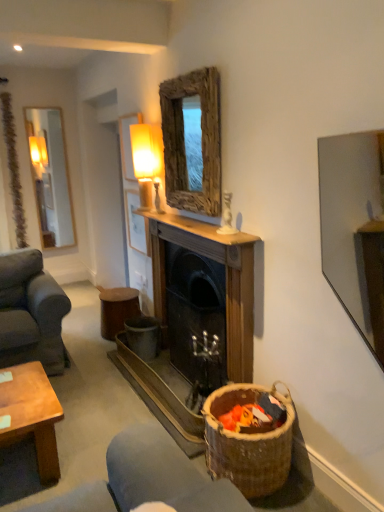
Image resolution: width=384 pixels, height=512 pixels. In order to click on rustic wood mirror at upper center in this screenshot , I will do `click(192, 141)`.

Where is `wooden stool at center`? The height and width of the screenshot is (512, 384). wooden stool at center is located at coordinates (117, 309).

The height and width of the screenshot is (512, 384). Describe the element at coordinates (226, 280) in the screenshot. I see `wooden fireplace at center` at that location.

In order to click on rustic wood mirror at upper center in this screenshot , I will do `click(192, 141)`.

Considering the positions of objects matte glass lamp at upper center and wooden fireplace at center in the image provided, who is behind, matte glass lamp at upper center or wooden fireplace at center?

matte glass lamp at upper center is behind.

Image resolution: width=384 pixels, height=512 pixels. I want to click on lamp to the left of wooden fireplace at center, so click(147, 161).

Based on their sizes in the image, would you say matte glass lamp at upper center is bigger or smaller than wooden fireplace at center?

In the image, matte glass lamp at upper center appears to be smaller than wooden fireplace at center.

Which is farther, (146, 157) or (157, 261)?

The point (157, 261) is farther from the camera.

Considering the sizes of objects wooden stool at center and rustic wood mirror at upper center in the image provided, who is smaller, wooden stool at center or rustic wood mirror at upper center?

With smaller size is rustic wood mirror at upper center.

From the picture: From the image's perspective, between wooden stool at center and rustic wood mirror at upper center, who is located below?

wooden stool at center appears lower in the image.

Does wooden stool at center appear on the left side of rustic wood mirror at upper center?

Indeed, wooden stool at center is positioned on the left side of rustic wood mirror at upper center.

How many degrees apart are the facing directions of wooden stool at center and rustic wood mirror at upper center?

0.503 degrees separate the facing orientations of wooden stool at center and rustic wood mirror at upper center.

Measure the distance between brown woven basket at lower right and matte glass lamp at upper center.

brown woven basket at lower right and matte glass lamp at upper center are 1.67 meters apart.

Which object is positioned more to the left, brown woven basket at lower right or matte glass lamp at upper center?

Positioned to the left is matte glass lamp at upper center.

Find the location of a particular element. Image resolution: width=384 pixels, height=512 pixels. basket below the matte glass lamp at upper center (from a real-world perspective) is located at coordinates (247, 443).

Considering the sizes of brown woven basket at lower right and matte glass lamp at upper center in the image, is brown woven basket at lower right wider or thinner than matte glass lamp at upper center?

In the image, brown woven basket at lower right appears to be wider than matte glass lamp at upper center.

From the image's perspective, which is above, rustic wood mirror at upper center or brown woven basket at lower right?

From the image's view, rustic wood mirror at upper center is above.

Is brown woven basket at lower right surrounded by rustic wood mirror at upper center?

Definitely not — brown woven basket at lower right is not inside rustic wood mirror at upper center.

In the scene shown: Does rustic wood mirror at upper center have a smaller size compared to brown woven basket at lower right?

Correct, rustic wood mirror at upper center occupies less space than brown woven basket at lower right.

From a real-world perspective, is rustic wood mirror at upper center on brown woven basket at lower right?

Yes.

Measure the distance between wooden fireplace at center and matte glass lamp at upper center.

They are 20.43 inches apart.

In the scene shown: Is wooden fireplace at center looking in the opposite direction of matte glass lamp at upper center?

No, wooden fireplace at center is not facing the opposite direction of matte glass lamp at upper center.

From the image's perspective, is wooden fireplace at center under matte glass lamp at upper center?

Yes, from the image's perspective, wooden fireplace at center is beneath matte glass lamp at upper center.

How many degrees apart are the facing directions of wooden fireplace at center and matte glass lamp at upper center?

The angle between the facing direction of wooden fireplace at center and the facing direction of matte glass lamp at upper center is 0.0137 degrees.

Considering the sizes of wooden stool at center and brown woven basket at lower right in the image, is wooden stool at center bigger or smaller than brown woven basket at lower right?

wooden stool at center is smaller than brown woven basket at lower right.

From a real-world perspective, who is located higher, wooden stool at center or brown woven basket at lower right?

brown woven basket at lower right, from a real-world perspective.

Is brown woven basket at lower right inside wooden stool at center?

No.

How distant is brown woven basket at lower right from rustic wood mirror at upper center?

A distance of 4.37 feet exists between brown woven basket at lower right and rustic wood mirror at upper center.

Does brown woven basket at lower right have a lesser width compared to rustic wood mirror at upper center?

In fact, brown woven basket at lower right might be wider than rustic wood mirror at upper center.

From the image's perspective, which one is positioned lower, brown woven basket at lower right or rustic wood mirror at upper center?

brown woven basket at lower right is shown below in the image.

Who is bigger, brown woven basket at lower right or rustic wood mirror at upper center?

With larger size is brown woven basket at lower right.

Locate an element on the screen. This screenshot has width=384, height=512. fireplace lying on the right of matte glass lamp at upper center is located at coordinates (226, 280).

The width and height of the screenshot is (384, 512). In order to click on stool on the left of the rustic wood mirror at upper center in this screenshot , I will do `click(117, 309)`.

Which object lies further to the anchor point brown woven basket at lower right, rustic wood mirror at upper center or wooden stool at center?

wooden stool at center.

From the image, which object appears to be farther from wooden stool at center, brown woven basket at lower right or rustic wood mirror at upper center?

brown woven basket at lower right.

Considering their positions, is rustic wood mirror at upper center positioned closer to wooden fireplace at center than matte glass lamp at upper center?

rustic wood mirror at upper center.

Based on their spatial positions, is wooden fireplace at center or wooden stool at center further from matte glass lamp at upper center?

wooden stool at center lies further to matte glass lamp at upper center than the other object.

Estimate the real-world distances between objects in this image. Which object is further from wooden fireplace at center, matte glass lamp at upper center or brown woven basket at lower right?

Based on the image, brown woven basket at lower right appears to be further to wooden fireplace at center.

When comparing their distances from matte glass lamp at upper center, does rustic wood mirror at upper center or wooden fireplace at center seem closer?

rustic wood mirror at upper center is positioned closer to the anchor matte glass lamp at upper center.

Consider the image. Looking at the image, which one is located further to wooden fireplace at center, wooden stool at center or rustic wood mirror at upper center?

Based on the image, wooden stool at center appears to be further to wooden fireplace at center.

Which object lies further to the anchor point wooden fireplace at center, brown woven basket at lower right or matte glass lamp at upper center?

brown woven basket at lower right is further to wooden fireplace at center.

Identify the location of mirror between brown woven basket at lower right and wooden stool at center from front to back. This screenshot has height=512, width=384. (192, 141).

I want to click on lamp between rustic wood mirror at upper center and wooden stool at center vertically, so click(147, 161).

I want to click on lamp positioned between brown woven basket at lower right and wooden stool at center from near to far, so click(147, 161).

Locate an element on the screen. The height and width of the screenshot is (512, 384). fireplace positioned between brown woven basket at lower right and wooden stool at center from near to far is located at coordinates (226, 280).